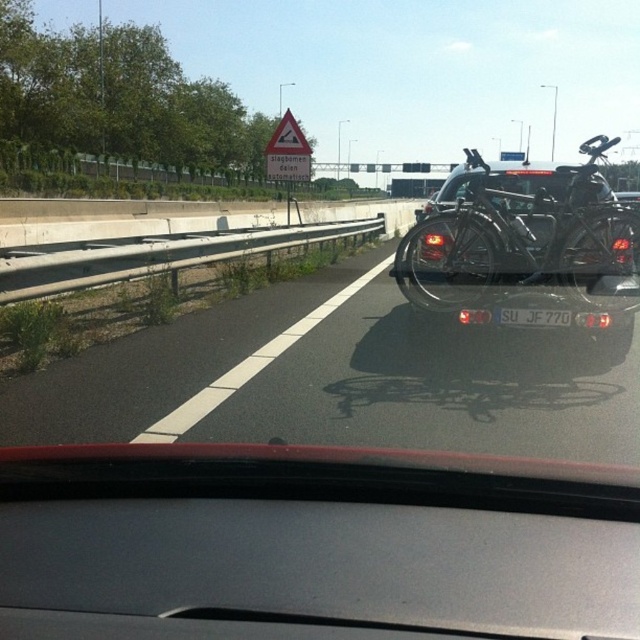
Question: Is shiny metallic bicycle at right below yellow plastic triangle at upper center?

Choices:
 (A) no
 (B) yes

Answer: (B)

Question: Which of the following is the farthest from the observer?

Choices:
 (A) click(552, 321)
 (B) click(492, 196)
 (C) click(282, 140)
 (D) click(266, 356)

Answer: (C)

Question: Which point is closer to the camera taking this photo?

Choices:
 (A) (516, 365)
 (B) (522, 314)
 (C) (595, 221)
 (D) (269, 157)

Answer: (C)

Question: Can you confirm if black asphalt road at center is thinner than white plastic license plate at center?

Choices:
 (A) no
 (B) yes

Answer: (A)

Question: Does shiny metallic bicycle at right appear over white plastic license plate at center?

Choices:
 (A) yes
 (B) no

Answer: (A)

Question: Which object appears closest to the camera in this image?

Choices:
 (A) black asphalt road at center
 (B) white plastic license plate at center
 (C) shiny metallic bicycle at right
 (D) yellow plastic triangle at upper center

Answer: (A)